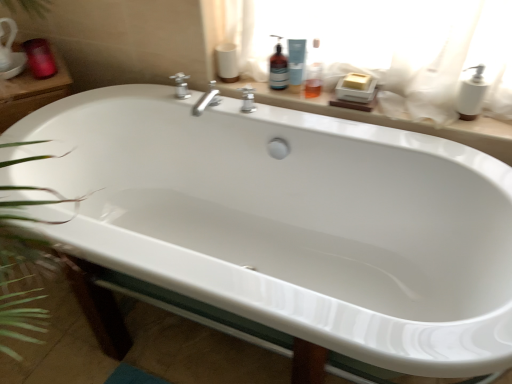
Where is `free region on the left part of white plastic soap dispenser at upper right`? The width and height of the screenshot is (512, 384). free region on the left part of white plastic soap dispenser at upper right is located at coordinates (x=422, y=117).